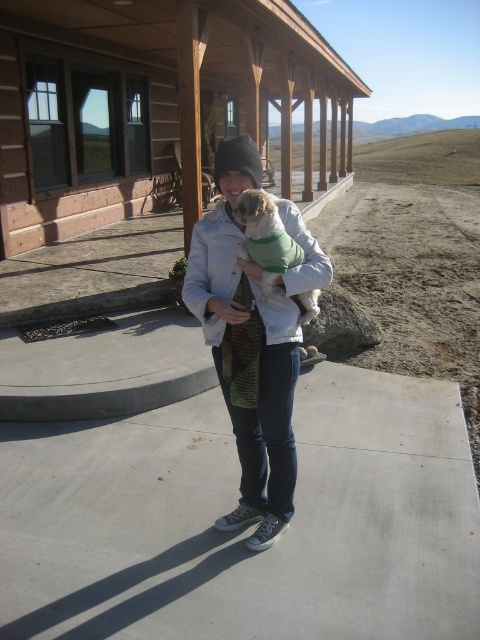
Does wooden log cabin at upper center come in front of fuzzy green sweater at center?

No, wooden log cabin at upper center is further to the viewer.

The width and height of the screenshot is (480, 640). Describe the element at coordinates (148, 104) in the screenshot. I see `wooden log cabin at upper center` at that location.

Identify the location of wooden log cabin at upper center. The image size is (480, 640). (148, 104).

Between wooden log cabin at upper center and denim jacket at center, which one appears on the right side from the viewer's perspective?

From the viewer's perspective, wooden log cabin at upper center appears more on the right side.

Between wooden log cabin at upper center and denim jacket at center, which one appears on the left side from the viewer's perspective?

From the viewer's perspective, denim jacket at center appears more on the left side.

I want to click on wooden log cabin at upper center, so click(x=148, y=104).

Find the location of a particular element. This screenshot has width=480, height=640. wooden log cabin at upper center is located at coordinates (148, 104).

Does denim jacket at center lie in front of fuzzy green sweater at center?

No, denim jacket at center is further to the viewer.

Is point (287, 340) positioned before point (272, 221)?

No, it is not.

Between point (259, 525) and point (265, 243), which one is positioned behind?

The point (259, 525) is more distant.

Where is `denim jacket at center`? denim jacket at center is located at coordinates (252, 340).